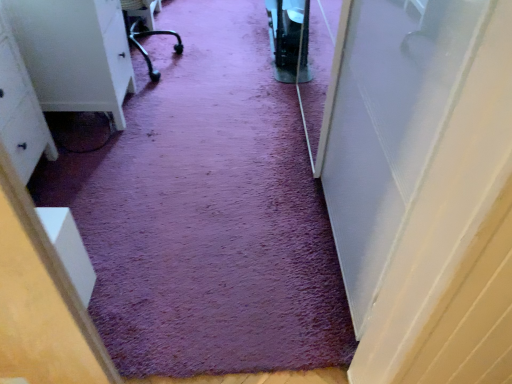
Question: From the image's perspective, relative to white matte dresser at left, is purple carpet at center above or below?

Choices:
 (A) below
 (B) above

Answer: (B)

Question: Would you say purple carpet at center is to the left or to the right of white matte dresser at left in the picture?

Choices:
 (A) right
 (B) left

Answer: (A)

Question: In the image, is purple carpet at center positioned in front of or behind white matte dresser at left?

Choices:
 (A) front
 (B) behind

Answer: (B)

Question: In the image, is white matte dresser at left positioned in front of or behind purple carpet at center?

Choices:
 (A) behind
 (B) front

Answer: (B)

Question: Considering the positions of white matte dresser at left and purple carpet at center in the image, is white matte dresser at left wider or thinner than purple carpet at center?

Choices:
 (A) thin
 (B) wide

Answer: (A)

Question: Is white matte dresser at left situated inside purple carpet at center or outside?

Choices:
 (A) inside
 (B) outside

Answer: (B)

Question: Is white matte dresser at left to the left or to the right of purple carpet at center in the image?

Choices:
 (A) right
 (B) left

Answer: (B)